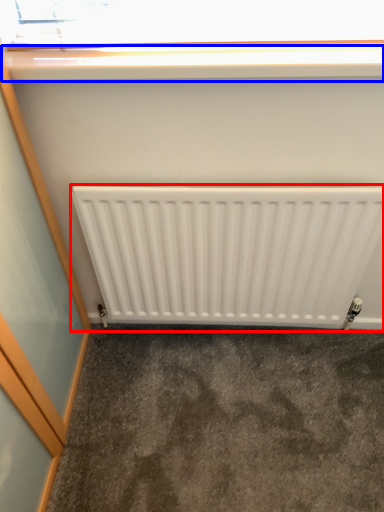
Question: Which object appears farthest to the camera in this image, radiator (highlighted by a red box) or window sill (highlighted by a blue box)?

Choices:
 (A) radiator
 (B) window sill

Answer: (A)